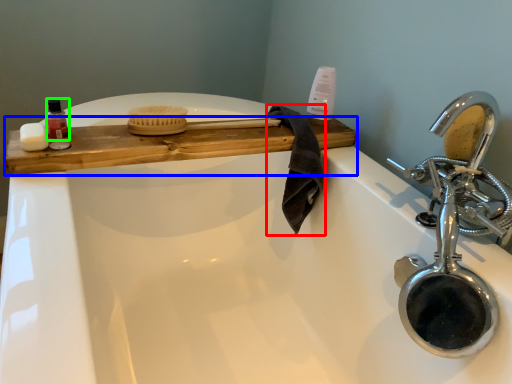
Question: Which is farther away from bath towel (highlighted by a red box)? counter (highlighted by a blue box) or mouthwash (highlighted by a green box)?

Choices:
 (A) counter
 (B) mouthwash

Answer: (B)